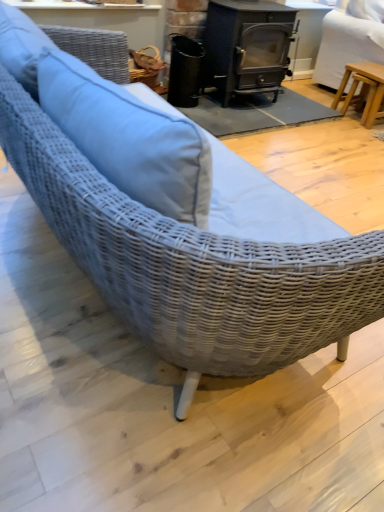
Question: From the image's perspective, is black matte trash can at center on top of light brown wooden stool at right?

Choices:
 (A) yes
 (B) no

Answer: (B)

Question: Can you confirm if black matte trash can at center is taller than light brown wooden stool at right?

Choices:
 (A) yes
 (B) no

Answer: (B)

Question: Is black matte trash can at center thinner than light brown wooden stool at right?

Choices:
 (A) yes
 (B) no

Answer: (A)

Question: Would you say light brown wooden stool at right is part of black matte trash can at center's contents?

Choices:
 (A) yes
 (B) no

Answer: (B)

Question: From a real-world perspective, is black matte trash can at center located higher than light brown wooden stool at right?

Choices:
 (A) yes
 (B) no

Answer: (B)

Question: Is the depth of black matte trash can at center greater than that of light brown wooden stool at right?

Choices:
 (A) no
 (B) yes

Answer: (A)

Question: Does black matte trash can at center lie in front of black cast iron wood burning stove at center?

Choices:
 (A) yes
 (B) no

Answer: (B)

Question: Is black matte trash can at center aimed at black cast iron wood burning stove at center?

Choices:
 (A) yes
 (B) no

Answer: (B)

Question: Is black matte trash can at center positioned behind black cast iron wood burning stove at center?

Choices:
 (A) no
 (B) yes

Answer: (B)

Question: From the image's perspective, is black matte trash can at center beneath black cast iron wood burning stove at center?

Choices:
 (A) no
 (B) yes

Answer: (B)

Question: Is black matte trash can at center not near black cast iron wood burning stove at center?

Choices:
 (A) yes
 (B) no

Answer: (B)

Question: Does black matte trash can at center have a lesser width compared to black cast iron wood burning stove at center?

Choices:
 (A) yes
 (B) no

Answer: (A)

Question: Is black cast iron wood burning stove at center completely or partially outside of black matte trash can at center?

Choices:
 (A) no
 (B) yes

Answer: (B)